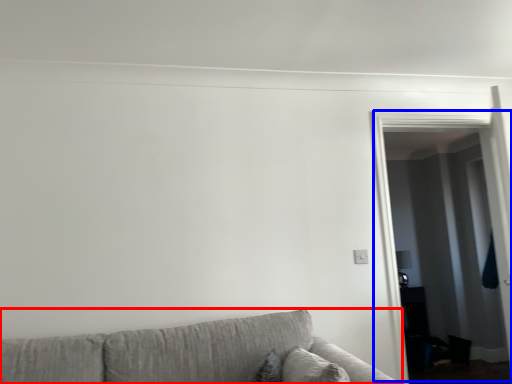
Question: Which point is closer to the camera, studio couch (highlighted by a red box) or glass door (highlighted by a blue box)?

Choices:
 (A) studio couch
 (B) glass door

Answer: (A)